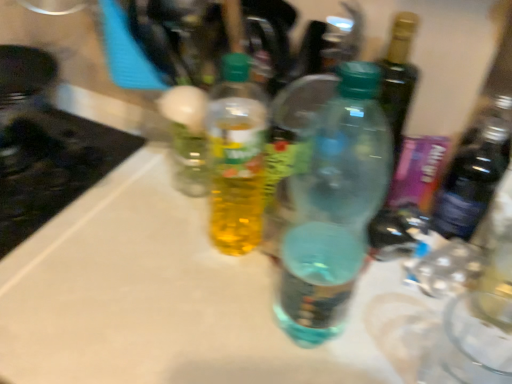
Question: Considering the relative sizes of translucent plastic bottle at center, the second bottle when ordered from right to left, and translucent plastic bottle at center, acting as the 1th bottle starting from the right, in the image provided, is translucent plastic bottle at center, the second bottle when ordered from right to left, shorter than translucent plastic bottle at center, acting as the 1th bottle starting from the right,?

Choices:
 (A) no
 (B) yes

Answer: (B)

Question: Can you confirm if translucent plastic bottle at center, positioned as the first bottle in left-to-right order, is wider than translucent plastic bottle at center, the second bottle from the left?

Choices:
 (A) yes
 (B) no

Answer: (B)

Question: Considering the relative positions of translucent plastic bottle at center, the second bottle when ordered from right to left, and translucent plastic bottle at center, the second bottle from the left, in the image provided, is translucent plastic bottle at center, the second bottle when ordered from right to left, to the right of translucent plastic bottle at center, the second bottle from the left, from the viewer's perspective?

Choices:
 (A) yes
 (B) no

Answer: (B)

Question: Considering the relative sizes of translucent plastic bottle at center, the second bottle when ordered from right to left, and translucent plastic bottle at center, the second bottle from the left, in the image provided, is translucent plastic bottle at center, the second bottle when ordered from right to left, smaller than translucent plastic bottle at center, the second bottle from the left,?

Choices:
 (A) yes
 (B) no

Answer: (A)

Question: From a real-world perspective, is translucent plastic bottle at center, positioned as the first bottle in left-to-right order, physically below translucent plastic bottle at center, the second bottle from the left?

Choices:
 (A) yes
 (B) no

Answer: (A)

Question: Is translucent plastic bottle at center, positioned as the first bottle in left-to-right order, thinner than translucent plastic bottle at center, acting as the 1th bottle starting from the right?

Choices:
 (A) yes
 (B) no

Answer: (A)

Question: Is translucent plastic bottle at center, positioned as the first bottle in left-to-right order, outside of black glass stove at left?

Choices:
 (A) yes
 (B) no

Answer: (A)

Question: Is the depth of translucent plastic bottle at center, positioned as the first bottle in left-to-right order, greater than that of black glass stove at left?

Choices:
 (A) no
 (B) yes

Answer: (A)

Question: Is translucent plastic bottle at center, positioned as the first bottle in left-to-right order, not close to black glass stove at left?

Choices:
 (A) yes
 (B) no

Answer: (B)

Question: From the image's perspective, does translucent plastic bottle at center, the second bottle when ordered from right to left, appear higher than black glass stove at left?

Choices:
 (A) no
 (B) yes

Answer: (A)

Question: From a real-world perspective, is translucent plastic bottle at center, positioned as the first bottle in left-to-right order, physically below black glass stove at left?

Choices:
 (A) yes
 (B) no

Answer: (B)

Question: Considering the relative positions of translucent plastic bottle at center, positioned as the first bottle in left-to-right order, and black glass stove at left in the image provided, is translucent plastic bottle at center, positioned as the first bottle in left-to-right order, to the left of black glass stove at left from the viewer's perspective?

Choices:
 (A) no
 (B) yes

Answer: (A)

Question: Considering the relative sizes of black glass stove at left and translucent plastic bottle at center, positioned as the first bottle in left-to-right order, in the image provided, is black glass stove at left smaller than translucent plastic bottle at center, positioned as the first bottle in left-to-right order,?

Choices:
 (A) no
 (B) yes

Answer: (A)